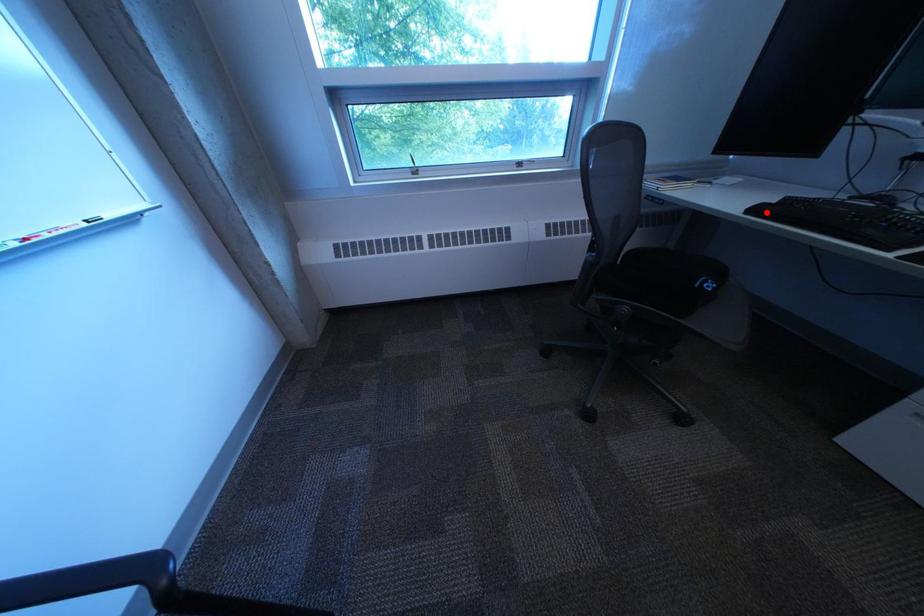
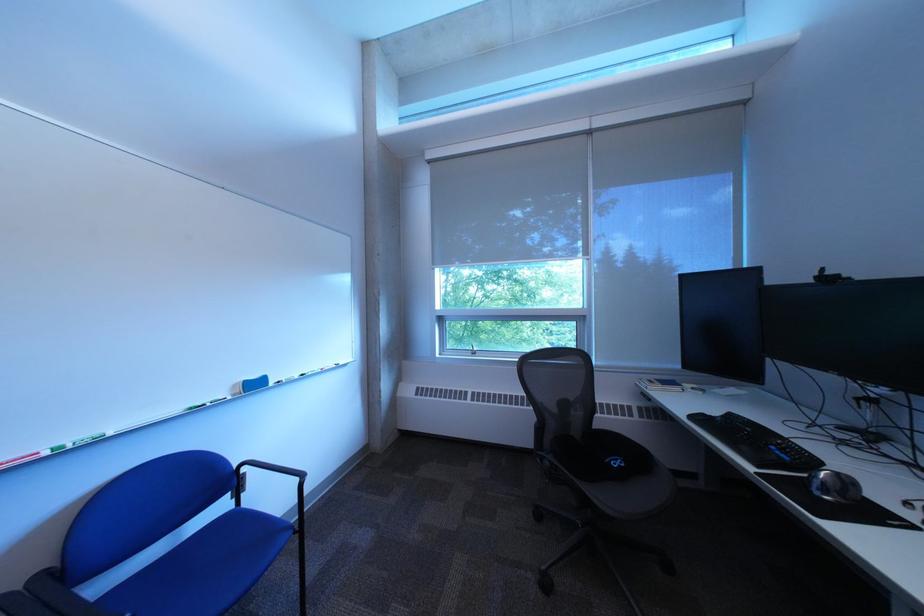
Where in the second image is the point corresponding to the highlighted location from the first image?

(708, 419)